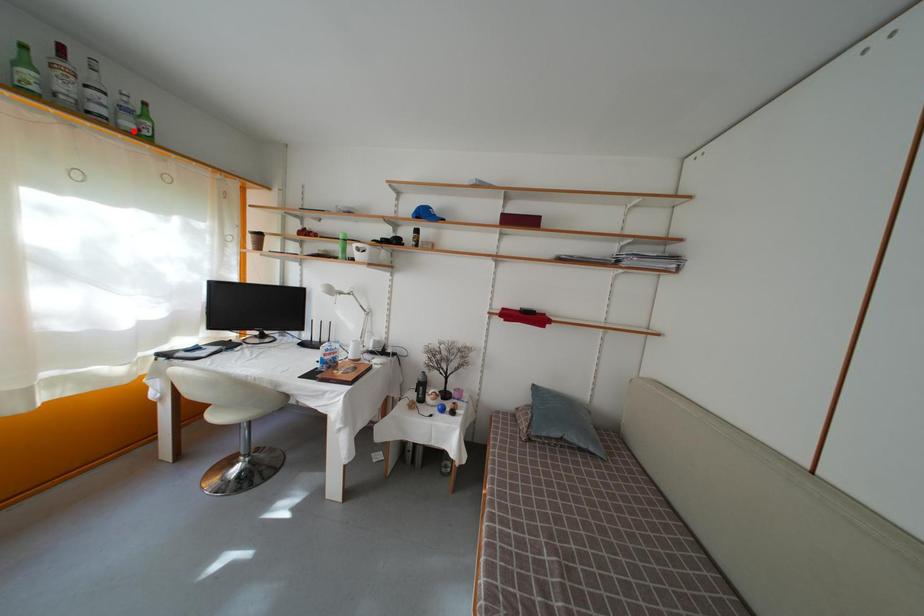
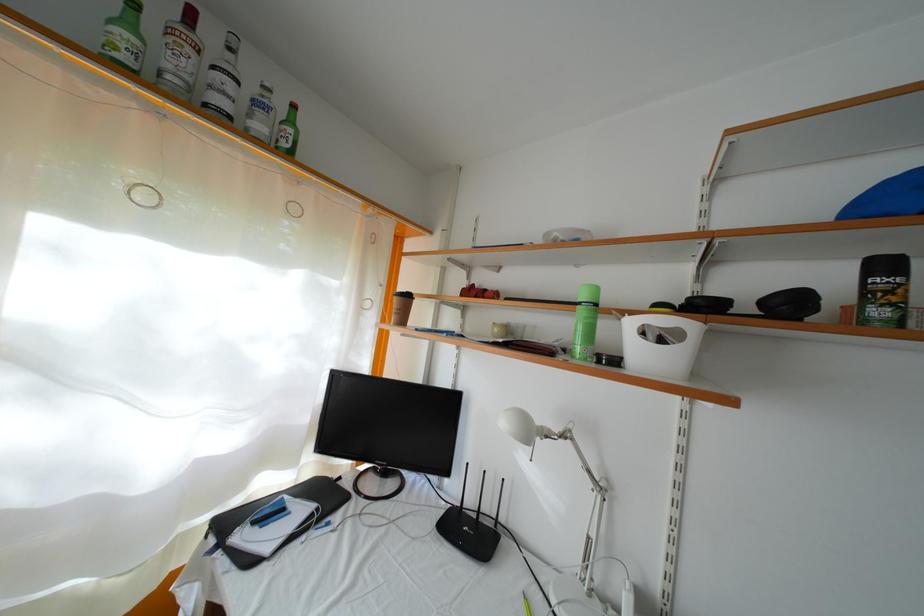
The point at the highlighted location is marked in the first image. Where is the corresponding point in the second image?

(264, 134)